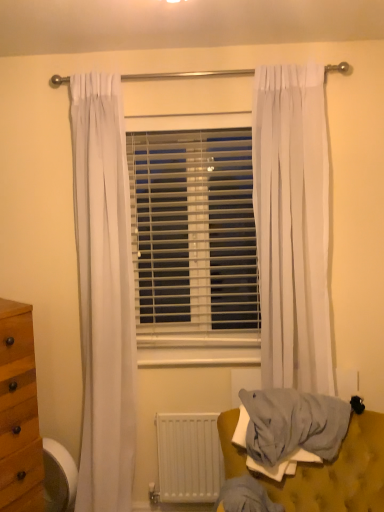
This screenshot has height=512, width=384. Describe the element at coordinates (189, 457) in the screenshot. I see `white matte radiator at lower center` at that location.

Describe the element at coordinates (292, 226) in the screenshot. I see `white sheer curtain at right` at that location.

Consider the image. What is the approximate height of light gray fabric at lower right?

light gray fabric at lower right is 50.20 centimeters in height.

In order to click on light gray fabric at lower right in this screenshot , I will do `click(322, 469)`.

Measure the distance between point (211, 191) and camera.

Point (211, 191) and camera are 2.08 meters apart from each other.

The height and width of the screenshot is (512, 384). Identify the location of white matte radiator at lower center. (189, 457).

Is light gray fabric at lower right beside white plastic blinds at center?

No, light gray fabric at lower right is not in contact with white plastic blinds at center.

Looking at this image, between light gray fabric at lower right and white plastic blinds at center, which one has more height?

Standing taller between the two is white plastic blinds at center.

From a real-world perspective, is light gray fabric at lower right below white plastic blinds at center?

Yes.

Is point (308, 471) closer to viewer compared to point (174, 241)?

Yes, point (308, 471) is in front of point (174, 241).

From the image's perspective, is white sheer curtain at right on white matte radiator at lower center?

Correct, white sheer curtain at right appears higher than white matte radiator at lower center in the image.

Between white sheer curtain at right and white matte radiator at lower center, which one has larger width?

white sheer curtain at right.

Between white sheer curtain at right and white matte radiator at lower center, which one appears on the right side from the viewer's perspective?

white sheer curtain at right is more to the right.

Relative to light gray fabric at lower right, is white plastic blinds at center in front or behind?

white plastic blinds at center is behind light gray fabric at lower right.

From a real-world perspective, relative to light gray fabric at lower right, is white plastic blinds at center vertically above or below?

white plastic blinds at center is situated higher than light gray fabric at lower right in the real world.

Is white plastic blinds at center wider than light gray fabric at lower right?

Incorrect, the width of white plastic blinds at center does not surpass that of light gray fabric at lower right.

At what (x,y) coordinates should I click in order to perform the action: click on window blind located above the light gray fabric at lower right (from a real-world perspective). Please return your answer as a coordinate pair (x, y). Looking at the image, I should click on (193, 231).

Based on the photo, from the image's perspective, is white plastic blinds at center above or below white sheer curtain at right?

white plastic blinds at center is below white sheer curtain at right.

Can you confirm if white plastic blinds at center is positioned to the left of white sheer curtain at right?

Yes.

Consider the image. Considering the sizes of objects white plastic blinds at center and white sheer curtain at right in the image provided, who is bigger, white plastic blinds at center or white sheer curtain at right?

white sheer curtain at right is bigger.

Considering the sizes of white matte radiator at lower center and wooden swivel chair at lower left in the image, is white matte radiator at lower center bigger or smaller than wooden swivel chair at lower left?

white matte radiator at lower center is bigger than wooden swivel chair at lower left.

Is white matte radiator at lower center outside of wooden swivel chair at lower left?

That's correct, white matte radiator at lower center is outside of wooden swivel chair at lower left.

From a real-world perspective, is white matte radiator at lower center physically below wooden swivel chair at lower left?

Actually, white matte radiator at lower center is physically above wooden swivel chair at lower left in the real world.

Is white matte radiator at lower center next to wooden swivel chair at lower left and touching it?

No, white matte radiator at lower center is not next to wooden swivel chair at lower left.

Is there a large distance between white matte radiator at lower center and white sheer curtain at right?

white matte radiator at lower center is near white sheer curtain at right, not far away.

Which is more to the left, white matte radiator at lower center or white sheer curtain at right?

white matte radiator at lower center.

From the image's perspective, is white matte radiator at lower center beneath white sheer curtain at right?

Indeed, from the image's perspective, white matte radiator at lower center is shown beneath white sheer curtain at right.

Which of these two, white matte radiator at lower center or white sheer curtain at right, stands shorter?

Standing shorter between the two is white matte radiator at lower center.

Which of these two, white sheer curtain at right or white plastic blinds at center, stands taller?

white sheer curtain at right.

From a real-world perspective, is white sheer curtain at right located higher than white plastic blinds at center?

Yes, from a real-world perspective, white sheer curtain at right is above white plastic blinds at center.

Considering the positions of objects white sheer curtain at right and white plastic blinds at center in the image provided, who is more to the left, white sheer curtain at right or white plastic blinds at center?

white plastic blinds at center.

Does white sheer curtain at right have a lesser width compared to white plastic blinds at center?

Incorrect, the width of white sheer curtain at right is not less than that of white plastic blinds at center.

Locate an element on the screen. furniture in front of the white plastic blinds at center is located at coordinates (322, 469).

This screenshot has height=512, width=384. Identify the location of radiator that is below the white sheer curtain at right (from the image's perspective). (189, 457).

When comparing their distances from white sheer curtain at right, does white matte radiator at lower center or light gray fabric at lower right seem closer?

light gray fabric at lower right.

From the image, which object appears to be nearer to white sheer curtain at right, wooden swivel chair at lower left or light gray fabric at lower right?

light gray fabric at lower right is closer to white sheer curtain at right.

Considering their positions, is white matte radiator at lower center positioned closer to white plastic blinds at center than light gray fabric at lower right?

Among the two, white matte radiator at lower center is located nearer to white plastic blinds at center.

Which object lies further to the anchor point white matte radiator at lower center, white plastic blinds at center or light gray fabric at lower right?

white plastic blinds at center is positioned further to the anchor white matte radiator at lower center.

From the image, which object appears to be farther from wooden swivel chair at lower left, white sheer curtain at right or white plastic blinds at center?

white sheer curtain at right is further to wooden swivel chair at lower left.

Considering their positions, is white plastic blinds at center positioned closer to light gray fabric at lower right than white sheer curtain at right?

white sheer curtain at right is closer to light gray fabric at lower right.

Considering their positions, is white matte radiator at lower center positioned closer to wooden swivel chair at lower left than light gray fabric at lower right?

Based on the image, white matte radiator at lower center appears to be nearer to wooden swivel chair at lower left.

Considering their positions, is light gray fabric at lower right positioned closer to wooden swivel chair at lower left than white sheer curtain at right?

The object closer to wooden swivel chair at lower left is light gray fabric at lower right.

This screenshot has height=512, width=384. Find the location of `radiator between wooden swivel chair at lower left and light gray fabric at lower right`. radiator between wooden swivel chair at lower left and light gray fabric at lower right is located at coordinates (189, 457).

Where is `radiator between white sheer curtain at right and wooden swivel chair at lower left from top to bottom`? radiator between white sheer curtain at right and wooden swivel chair at lower left from top to bottom is located at coordinates (189, 457).

This screenshot has width=384, height=512. Identify the location of furniture between white plastic blinds at center and white matte radiator at lower center in the up-down direction. (322, 469).

Where is `window blind between white sheer curtain at right and wooden swivel chair at lower left in the up-down direction`? Image resolution: width=384 pixels, height=512 pixels. window blind between white sheer curtain at right and wooden swivel chair at lower left in the up-down direction is located at coordinates (193, 231).